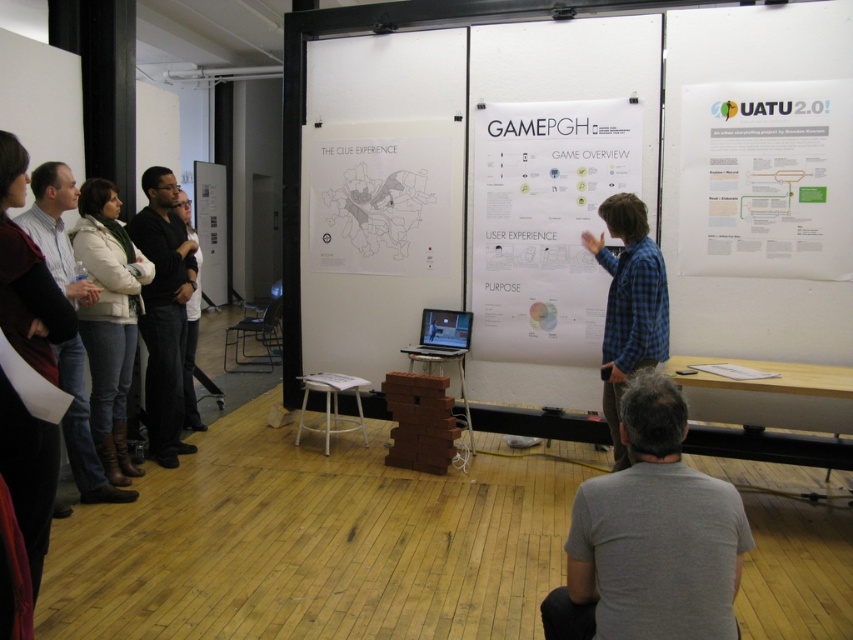
Question: In this image, where is white paper poster at upper right located relative to white knit sweater at left?

Choices:
 (A) right
 (B) left

Answer: (A)

Question: Can you confirm if white paper map at center is bigger than white knit sweater at left?

Choices:
 (A) no
 (B) yes

Answer: (A)

Question: Which object appears closest to the camera in this image?

Choices:
 (A) blue plaid shirt at center
 (B) gray cotton shirt at lower center

Answer: (B)

Question: Which point appears closest to the camera in this image?

Choices:
 (A) (573, 621)
 (B) (204, 422)

Answer: (A)

Question: Is white paper poster at center further to the viewer compared to dark blue jeans at left?

Choices:
 (A) no
 (B) yes

Answer: (A)

Question: Which object is the farthest from the black leather jacket at left?

Choices:
 (A) white paper poster at upper right
 (B) gray cotton shirt at lower center

Answer: (A)